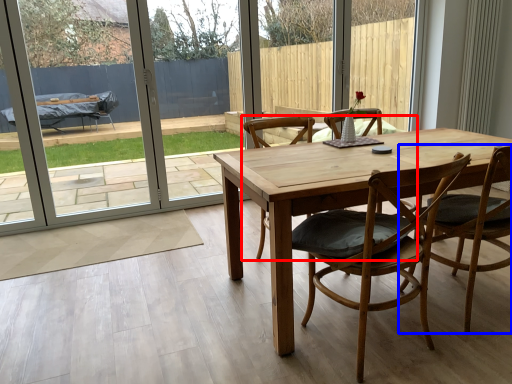
Question: Which object appears closest to the camera in this image, chair (highlighted by a red box) or chair (highlighted by a blue box)?

Choices:
 (A) chair
 (B) chair

Answer: (B)